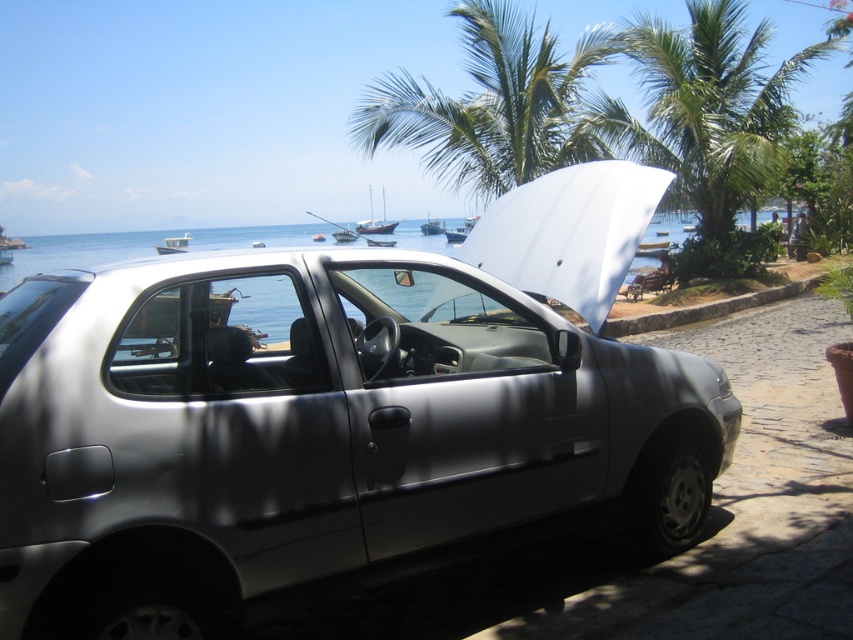
Consider the image. Is satin silver car at center below wooden sailboat at center?

Indeed, satin silver car at center is positioned under wooden sailboat at center.

Between satin silver car at center and wooden sailboat at center, which one has more height?

wooden sailboat at center is taller.

Between point (596, 451) and point (366, 230), which one is positioned behind?

The point (366, 230) is more distant.

This screenshot has width=853, height=640. Identify the location of satin silver car at center. (312, 429).

Does green leafy palm tree at upper right come in front of white glossy boat at center?

Yes, green leafy palm tree at upper right is closer to the viewer.

Who is higher up, green leafy palm tree at upper right or white glossy boat at center?

Positioned higher is white glossy boat at center.

The width and height of the screenshot is (853, 640). Identify the location of green leafy palm tree at upper right. (709, 122).

Is satin silver car at center taller than green leafy palm tree at upper center?

No.

Between satin silver car at center and green leafy palm tree at upper center, which one has less height?

Standing shorter between the two is satin silver car at center.

Between point (439, 493) and point (552, 144), which one is positioned in front?

Point (439, 493) is in front.

The width and height of the screenshot is (853, 640). Find the location of `satin silver car at center`. satin silver car at center is located at coordinates (312, 429).